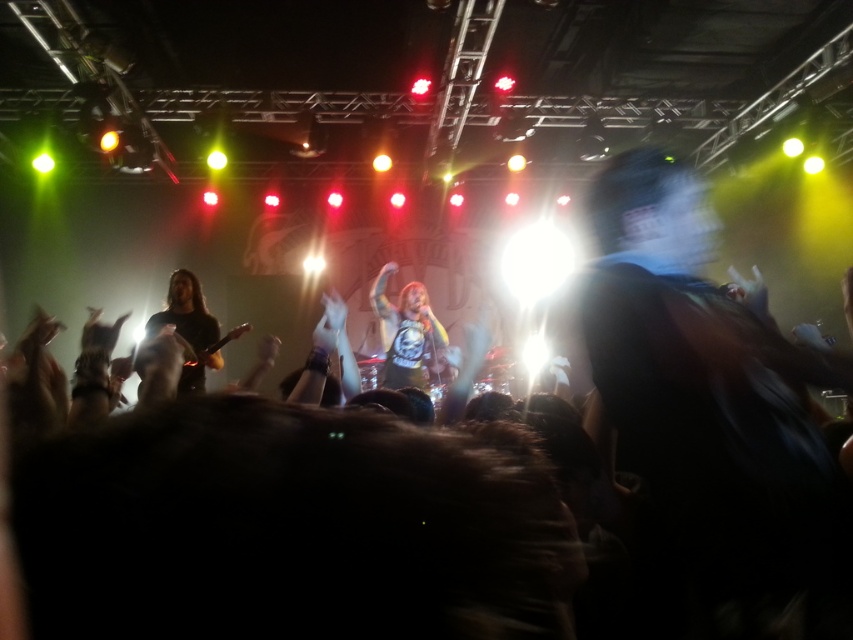
Question: Does shiny silver guitar at center have a greater width compared to black matte guitar at left?

Choices:
 (A) yes
 (B) no

Answer: (A)

Question: Can you confirm if shiny silver guitar at center is positioned below black matte guitar at left?

Choices:
 (A) no
 (B) yes

Answer: (B)

Question: Which point appears farthest from the camera in this image?

Choices:
 (A) (190, 387)
 (B) (445, 342)

Answer: (B)

Question: Which point is closer to the camera?

Choices:
 (A) black matte guitar at left
 (B) shiny silver guitar at center

Answer: (A)

Question: Is shiny silver guitar at center further to camera compared to black matte guitar at left?

Choices:
 (A) no
 (B) yes

Answer: (B)